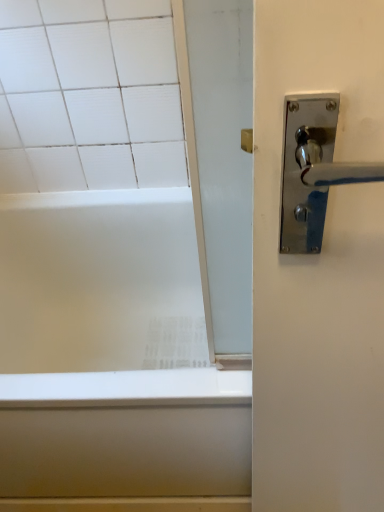
This screenshot has width=384, height=512. Find the location of `white matte bathtub at lower left`. white matte bathtub at lower left is located at coordinates (112, 353).

Describe the element at coordinates (112, 353) in the screenshot. This screenshot has height=512, width=384. I see `white matte bathtub at lower left` at that location.

Identify the location of white matte bathtub at lower left. The width and height of the screenshot is (384, 512). tap(112, 353).